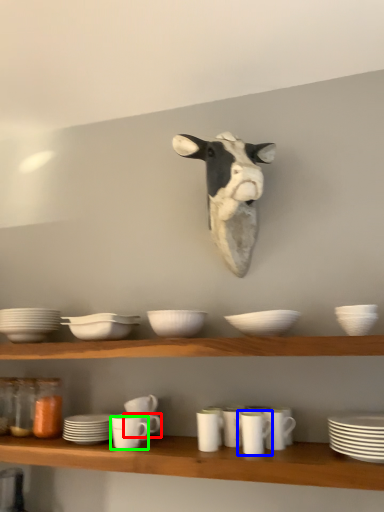
Question: Which is nearer to the tableware (highlighted by a red box)? tableware (highlighted by a blue box) or tableware (highlighted by a green box).

Choices:
 (A) tableware
 (B) tableware

Answer: (B)